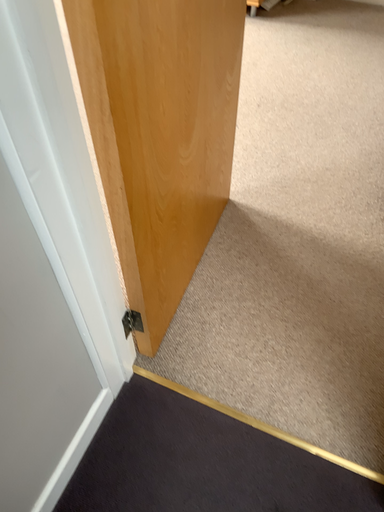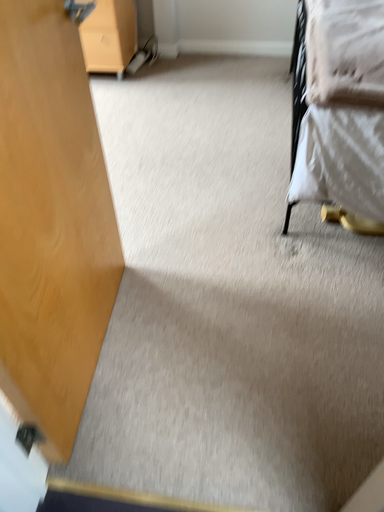
Question: Which way did the camera rotate in the video?

Choices:
 (A) rotated upward
 (B) rotated downward

Answer: (A)